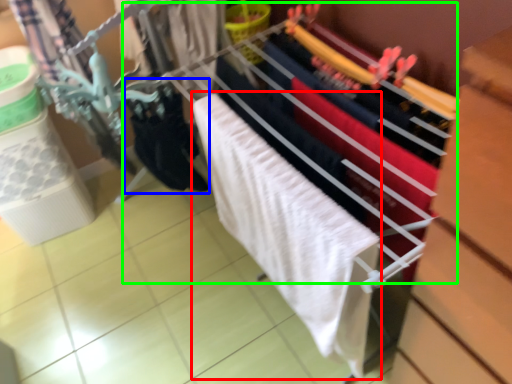
Question: Which object is positioned farthest from bath towel (highlighted by a red box)? Select from clothing (highlighted by a blue box) and closet (highlighted by a green box).

Choices:
 (A) clothing
 (B) closet

Answer: (A)